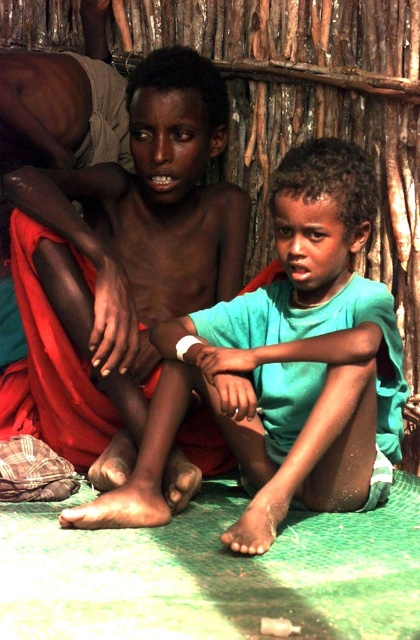
Question: Can you confirm if green matte shirt at center is smaller than matte skin boy at center?

Choices:
 (A) yes
 (B) no

Answer: (A)

Question: Is green matte shirt at center wider than matte skin boy at center?

Choices:
 (A) yes
 (B) no

Answer: (A)

Question: In this image, where is green matte shirt at center located relative to matte skin boy at center?

Choices:
 (A) right
 (B) left

Answer: (A)

Question: Which object appears farthest from the camera in this image?

Choices:
 (A) matte skin boy at center
 (B) green matte shirt at center

Answer: (A)

Question: Which point appears closest to the camera in this image?

Choices:
 (A) (84, 454)
 (B) (94, 513)

Answer: (B)